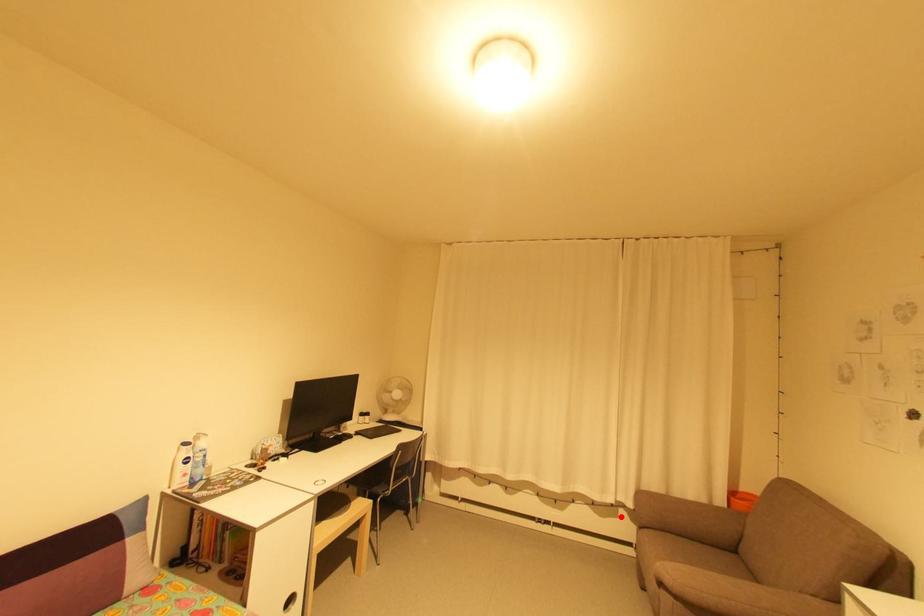
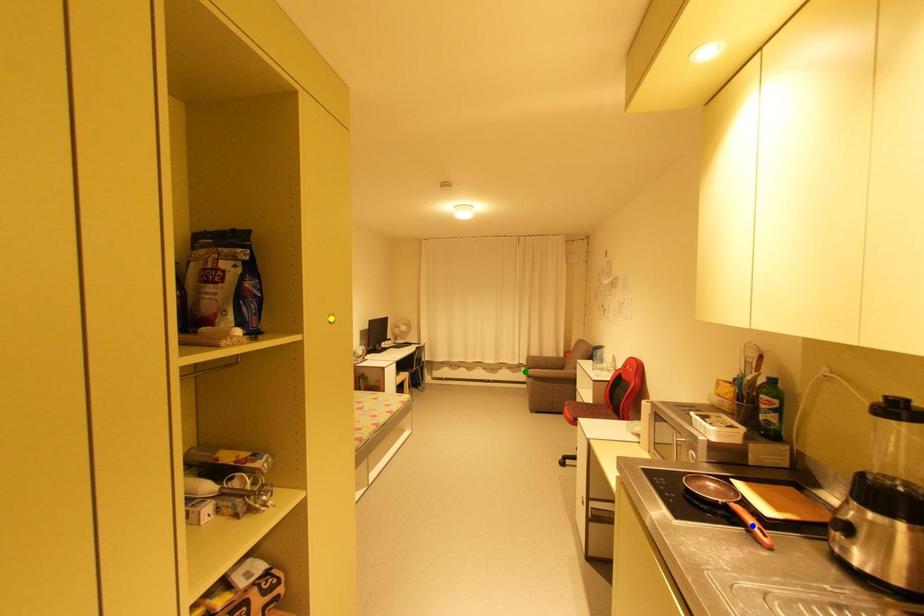
Question: I am providing you with two images of the same scene from different viewpoints. A red point is marked on the first image. You are given multiple points on the second image. Which point in image 2 is actually the same real-world point as the red point in image 1?

Choices:
 (A) yellow point
 (B) blue point
 (C) green point

Answer: (C)